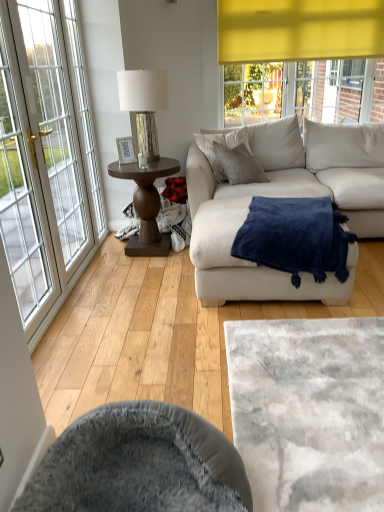
Image resolution: width=384 pixels, height=512 pixels. I want to click on vacant area that lies between dark brown wood side table at center left and velvet grey swivel chair at lower center, so click(x=148, y=328).